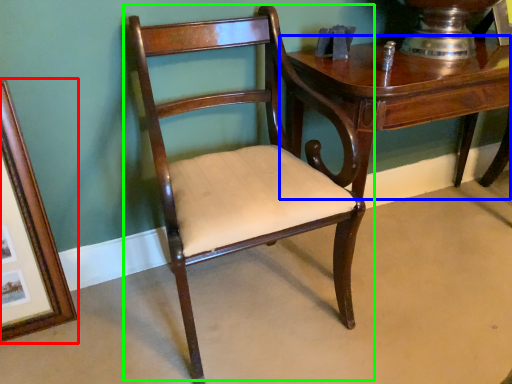
Question: Which is farther away from picture frame (highlighted by a red box)? table (highlighted by a blue box) or chair (highlighted by a green box)?

Choices:
 (A) table
 (B) chair

Answer: (A)